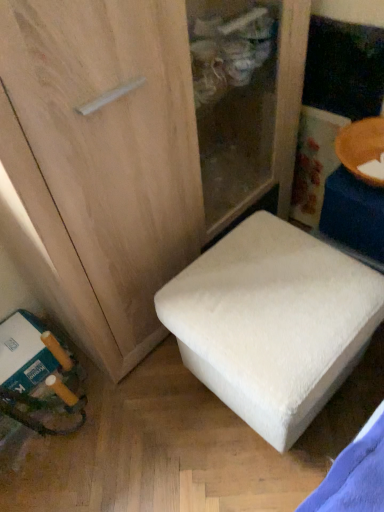
Find the location of a particular element. Image resolution: width=384 pixels, height=512 pixels. white fluffy ottoman at center is located at coordinates (272, 323).

Describe the element at coordinates (272, 323) in the screenshot. This screenshot has height=512, width=384. I see `white fluffy ottoman at center` at that location.

Identify the location of white fluffy ottoman at center. (272, 323).